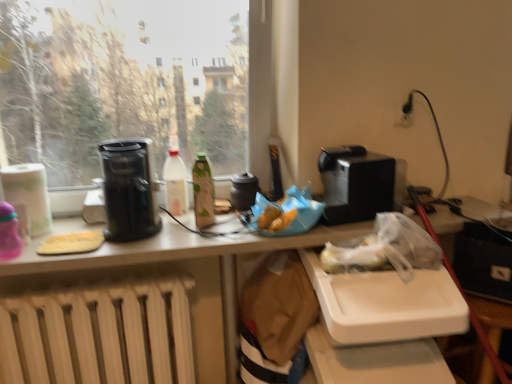
Where is `blank space situated above yellow sponge at left (from a real-world perspective)`? blank space situated above yellow sponge at left (from a real-world perspective) is located at coordinates (75, 237).